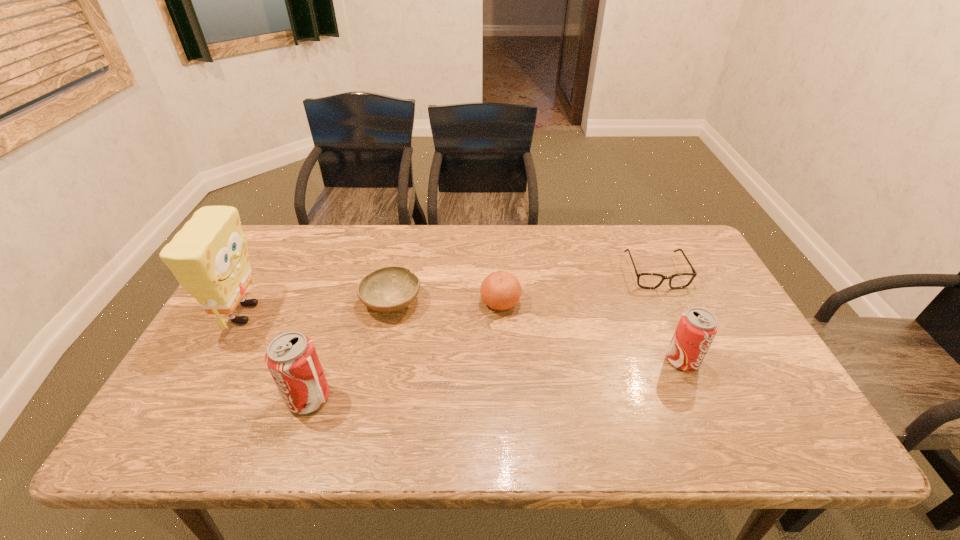
The image size is (960, 540). I want to click on the left soda can, so click(291, 358).

Locate an element on the screen. Image resolution: width=960 pixels, height=540 pixels. the taller soda can is located at coordinates tap(291, 358).

At what (x,y) coordinates should I click in order to perform the action: click on the fourth shortest object. Please return your answer as a coordinate pair (x, y). The image size is (960, 540). Looking at the image, I should click on (697, 328).

The width and height of the screenshot is (960, 540). Identify the location of the shorter soda can. (697, 328).

Locate an element on the screen. The width and height of the screenshot is (960, 540). spectacles is located at coordinates (644, 280).

The height and width of the screenshot is (540, 960). Identify the location of sponge. (209, 258).

At what (x,y) coordinates should I click in order to perform the action: click on the leftmost object. Please return your answer as a coordinate pair (x, y). This screenshot has height=540, width=960. Looking at the image, I should click on (209, 258).

The width and height of the screenshot is (960, 540). Identify the location of clementine. (500, 290).

This screenshot has height=540, width=960. What are the coordinates of `the third shortest object` in the screenshot? It's located at (500, 290).

Where is `bowl`? Image resolution: width=960 pixels, height=540 pixels. bowl is located at coordinates (387, 289).